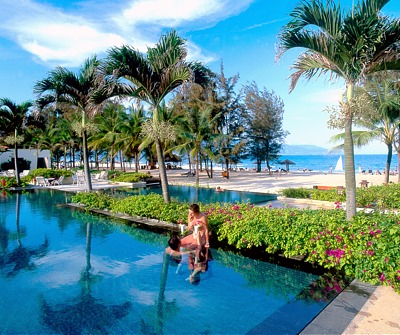
Identify the location of plant. This screenshot has width=400, height=335. (277, 225).